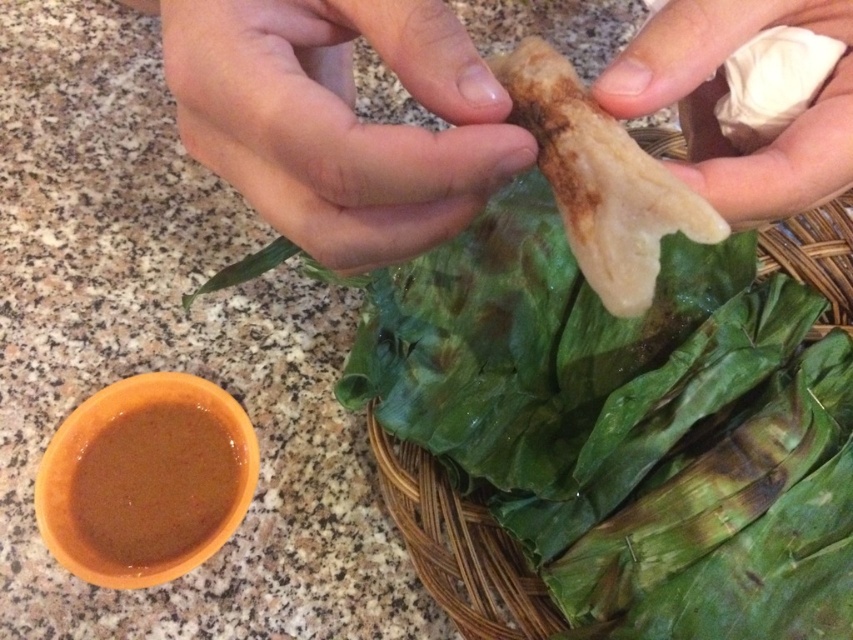
Is point (357, 20) in front of point (131, 435)?

Yes, it is.

Can you confirm if smooth skin hand at upper center is wider than brown matte sauce at lower left?

No.

Does point (229, 12) come farther from viewer compared to point (119, 544)?

That is False.

Locate an element on the screen. The image size is (853, 640). smooth skin hand at upper center is located at coordinates (339, 120).

Is white matte pastry at center closer to the viewer compared to brown matte sauce at lower left?

Yes, it is.

Between white matte pastry at center and brown matte sauce at lower left, which one is positioned lower?

brown matte sauce at lower left is lower down.

Locate an element on the screen. Image resolution: width=853 pixels, height=640 pixels. white matte pastry at center is located at coordinates pos(601,179).

Can you confirm if smooth skin hand at upper center is thinner than green leafy at upper center?

Indeed, smooth skin hand at upper center has a lesser width compared to green leafy at upper center.

Can you confirm if smooth skin hand at upper center is positioned to the right of green leafy at upper center?

In fact, smooth skin hand at upper center is to the left of green leafy at upper center.

Between point (426, 65) and point (397, 528), which one is positioned in front?

Positioned in front is point (426, 65).

Where is `smooth skin hand at upper center`? This screenshot has width=853, height=640. smooth skin hand at upper center is located at coordinates (339, 120).